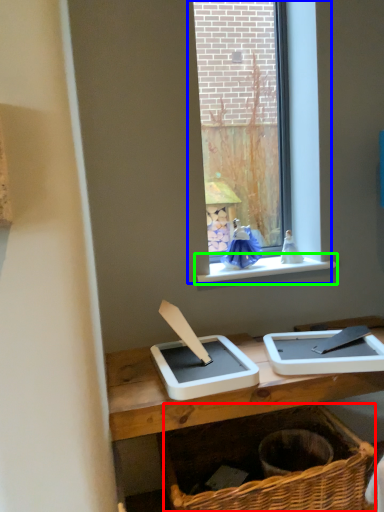
Question: Considering the real-world distances, which object is farthest from basket (highlighted by a red box)? window (highlighted by a blue box) or window sill (highlighted by a green box)?

Choices:
 (A) window
 (B) window sill

Answer: (A)